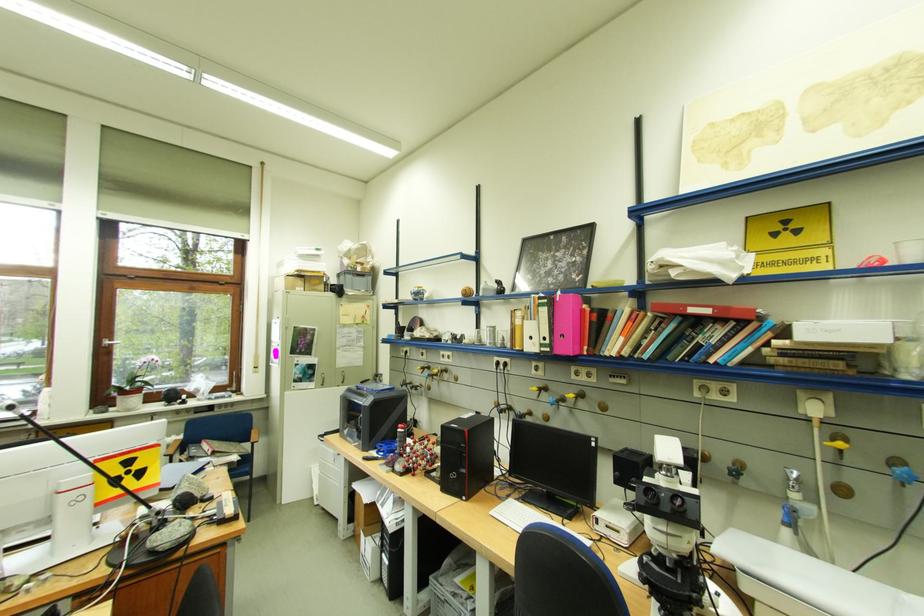
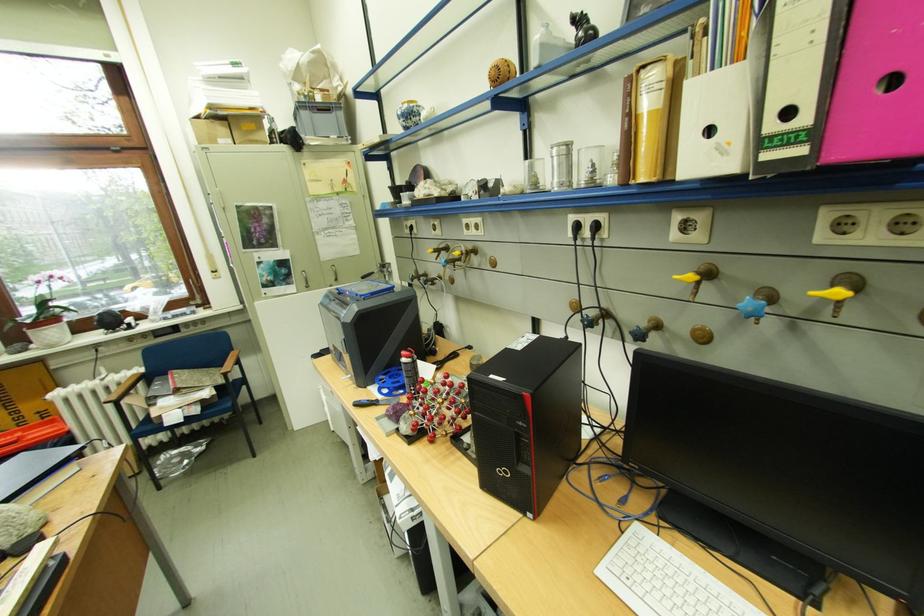
Find the pixel in the second image that matches [572,339] in the first image.

(890, 92)